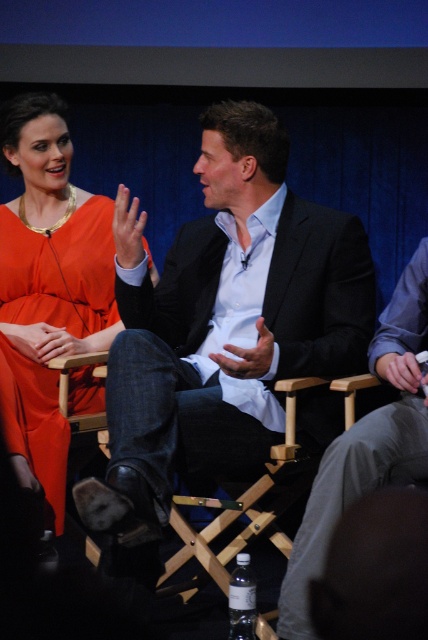
You are organizing a photo shoot and need to ensure that the matte black suit at center and the matte orange dress at upper left are positioned appropriately. Based on their sizes, which one requires more horizontal space for proper framing?

The matte black suit at center might require more horizontal space for proper framing since it is wider than the matte orange dress at upper left.

You are a photographer adjusting your camera settings. You notice two points in the scene at coordinates point [44,444] and point [315,493]. Which point is closer to your camera lens?

Point [44,444] is further to the camera than point [315,493], so the closer point to the camera lens is point [315,493].

You are a fashion designer observing the panel discussion. You need to determine which suit, the matte black suit at center or the dark gray suit at center, requires more fabric to make. Based on the image, which one would you choose?

The matte black suit at center is bigger than the dark gray suit at center, so it requires more fabric to make.